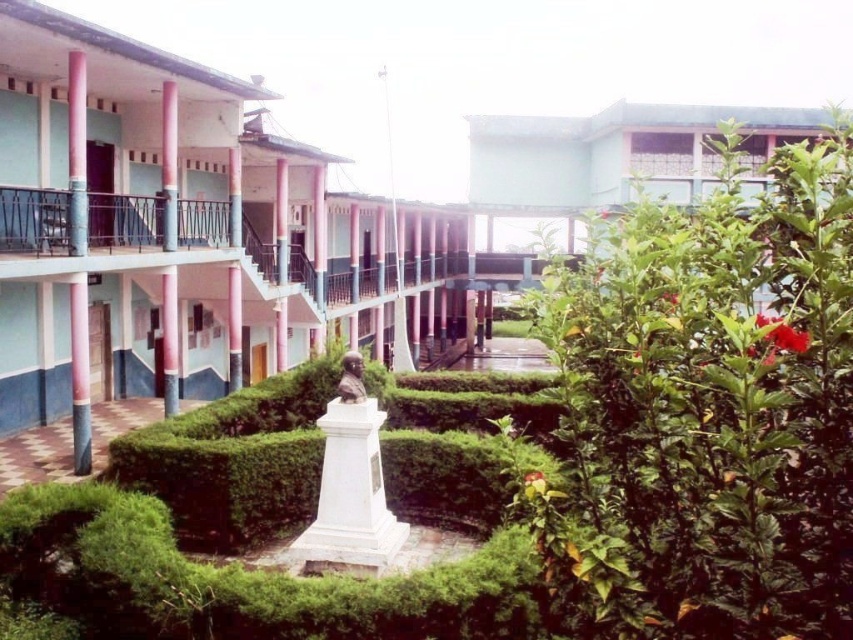
Question: Which is nearer to the white marble statue at center?

Choices:
 (A) green leafy bush at right
 (B) white glossy pillar at center
 (C) pink glossy pole at left
 (D) green leafy hedge at center

Answer: (D)

Question: Which point appears closest to the camera in this image?

Choices:
 (A) (83, 337)
 (B) (677, 292)
 (C) (248, 435)

Answer: (B)

Question: Is white marble statue at center behind green leafy hedge at center?

Choices:
 (A) no
 (B) yes

Answer: (A)

Question: Is green leafy hedge at center thinner than white glossy pillar at center?

Choices:
 (A) no
 (B) yes

Answer: (A)

Question: Is pink glossy pole at left bigger than red matte flower at center right?

Choices:
 (A) no
 (B) yes

Answer: (B)

Question: Estimate the real-world distances between objects in this image. Which object is farther from the red matte flower at center right?

Choices:
 (A) bright red petal at upper right
 (B) green leafy bush at right
 (C) green leafy hedge at center

Answer: (C)